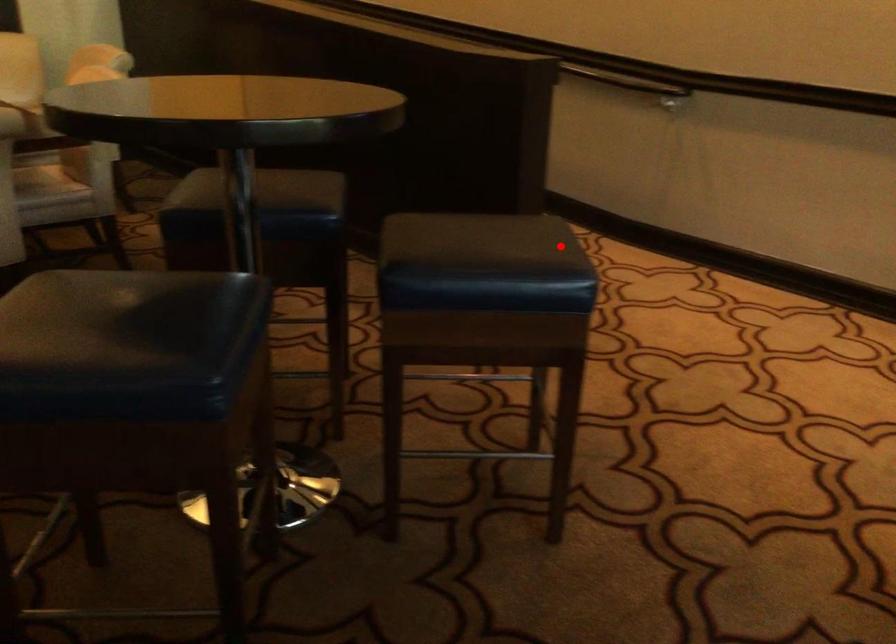
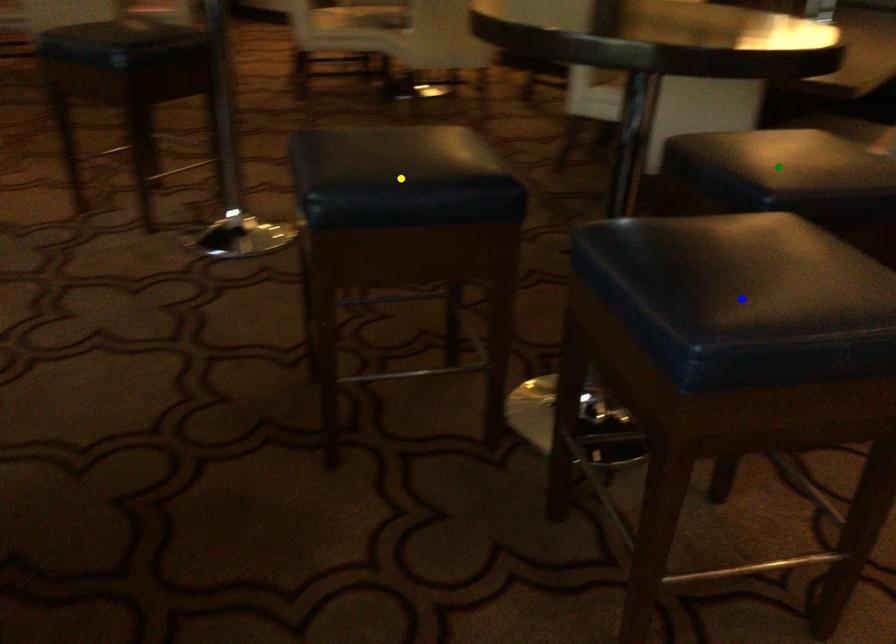
Question: I am providing you with two images of the same scene from different viewpoints. A red point is marked on the first image. You are given multiple points on the second image. Which point in image 2 represents the same 3d spot as the red point in image 1?

Choices:
 (A) green point
 (B) yellow point
 (C) blue point

Answer: (C)